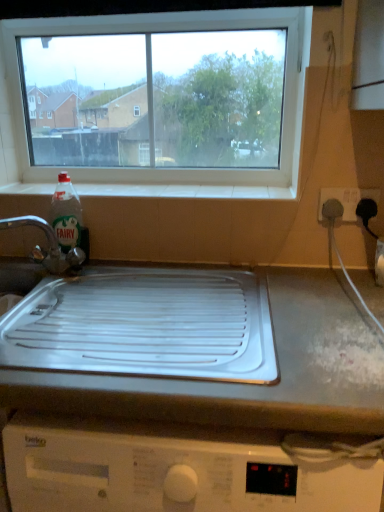
What are the coordinates of `blank space above white plastic tray at center (from a real-world perspective)` in the screenshot? It's located at (251, 337).